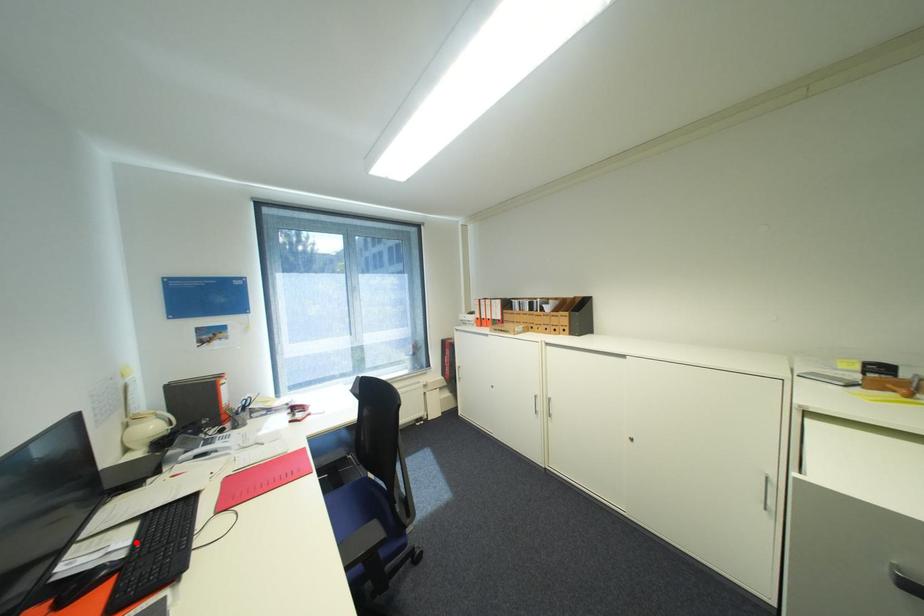
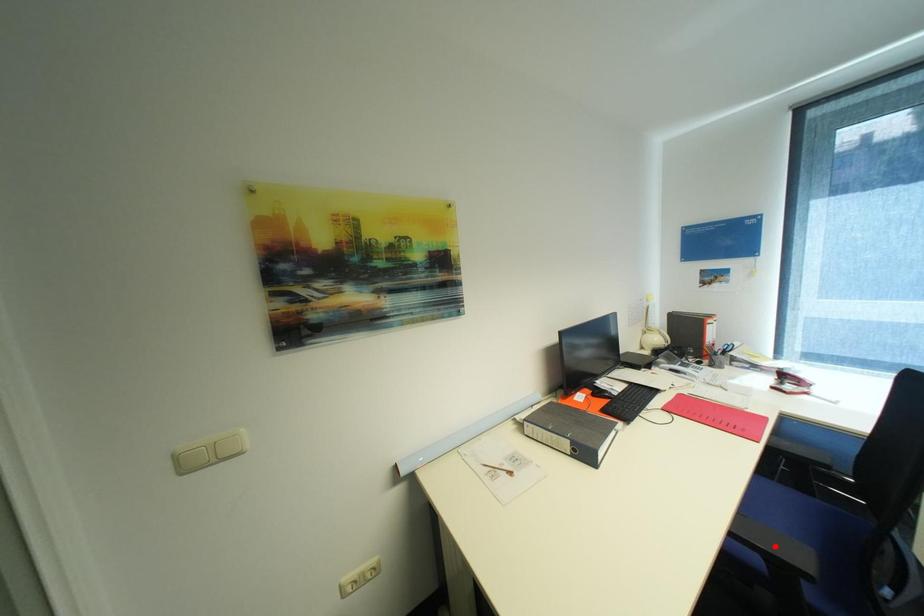
I am providing you with two images of the same scene from different viewpoints. A red point is marked on the first image and another point is marked on the second image. Does the point marked in image1 correspond to the same location as the one in image2?

No